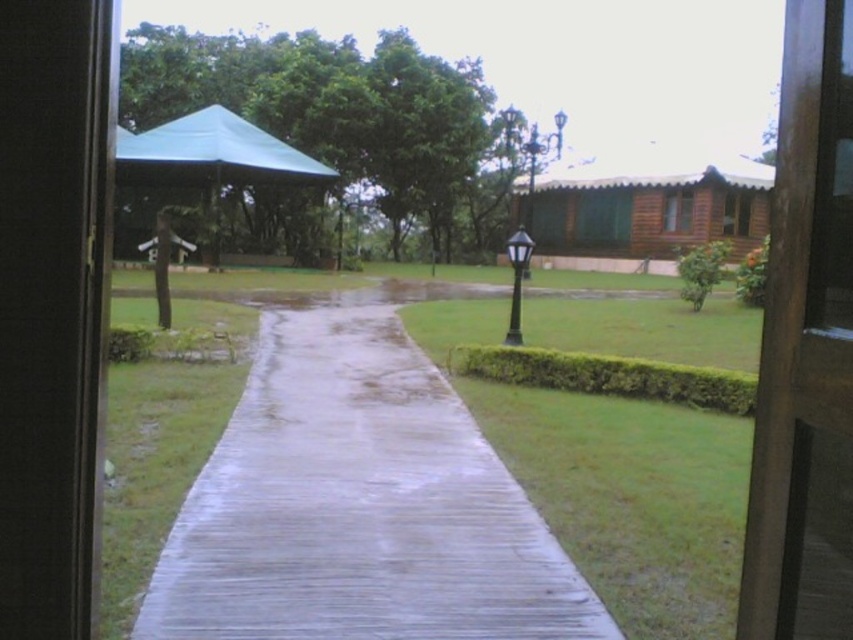
You are a delivery person holding a 2.5 meter long package. You want to place it on the white concrete pavement at center. Can you fit the package on the pavement without it extending beyond its edges?

The white concrete pavement at center is 3.28 meters from viewer. Since the package is 2.5 meters long, it can fit on the pavement as the distance from the viewer to the pavement is greater than the package length.

You are standing inside the building looking through the window. You see the white concrete pavement at center and the brown wooden hut at center. Which object is closer to you?

The white concrete pavement at center is closer to the viewer than the brown wooden hut at center.